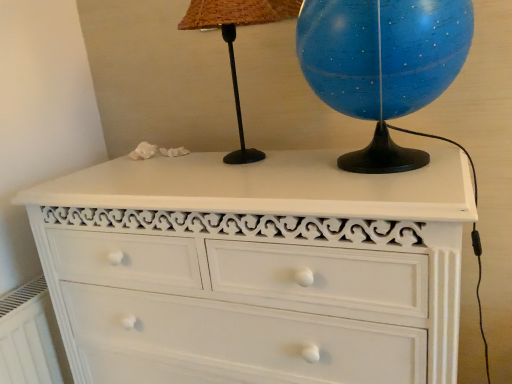
Locate an element on the screen. Image resolution: width=512 pixels, height=384 pixels. empty space that is ontop of white painted wood chest of drawers at center (from a real-world perspective) is located at coordinates (252, 168).